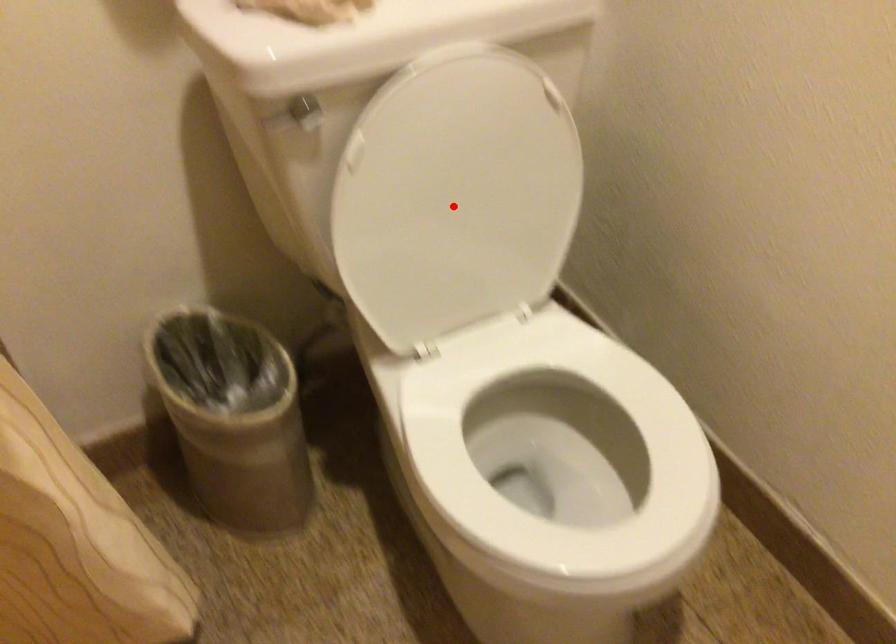
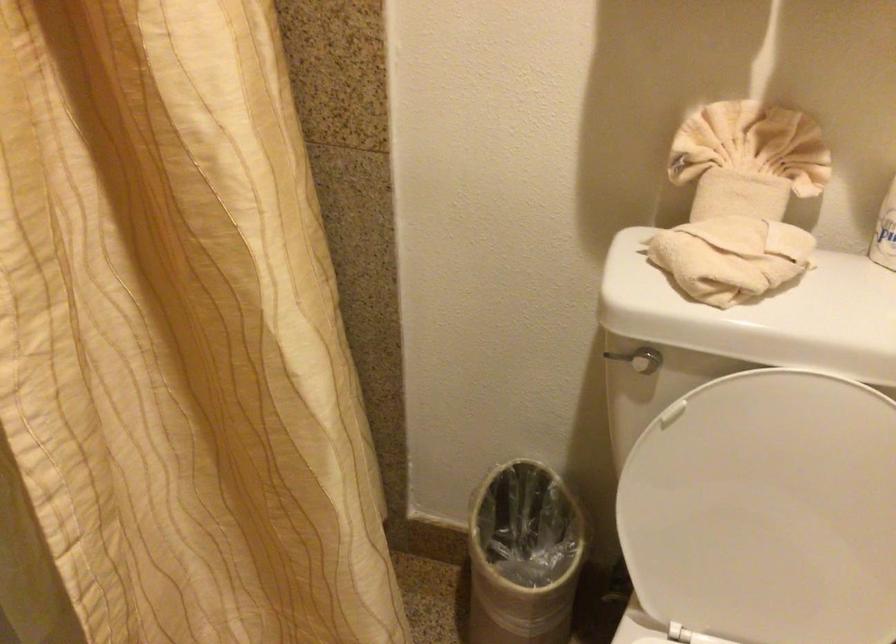
Question: I am providing you with two images of the same scene from different viewpoints. Given a red point in image1, look at the same physical point in image2. Is it:

Choices:
 (A) Closer to the viewpoint
 (B) Farther from the viewpoint

Answer: (A)